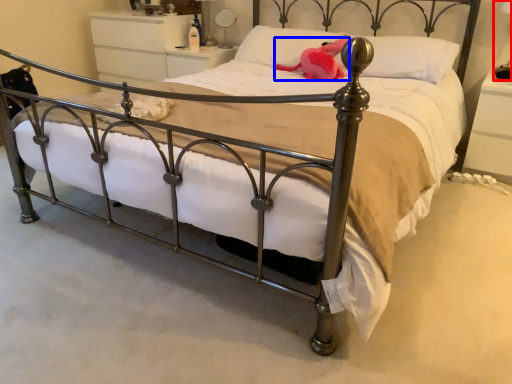
Question: Among these objects, which one is farthest to the camera, table lamp (highlighted by a red box) or animal (highlighted by a blue box)?

Choices:
 (A) table lamp
 (B) animal

Answer: (B)